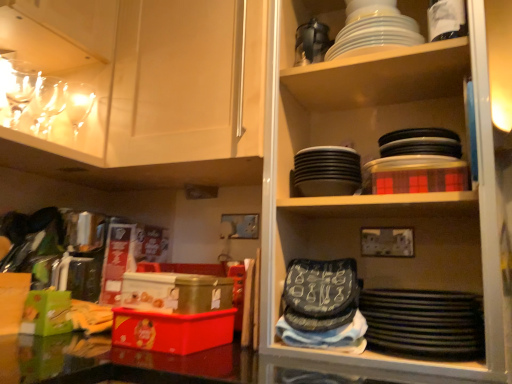
Question: From a real-world perspective, is clear glass wine glasses at upper left, which is the second tableware from left to right, below matte white cabinet at upper left?

Choices:
 (A) yes
 (B) no

Answer: (A)

Question: From the image's perspective, does clear glass wine glasses at upper left, which is the second tableware from left to right, appear lower than matte white cabinet at upper left?

Choices:
 (A) no
 (B) yes

Answer: (B)

Question: From a real-world perspective, is clear glass wine glasses at upper left, which is the second tableware from left to right, physically above matte white cabinet at upper left?

Choices:
 (A) no
 (B) yes

Answer: (A)

Question: Does clear glass wine glasses at upper left, acting as the third tableware starting from the right, have a greater height compared to matte white cabinet at upper left?

Choices:
 (A) no
 (B) yes

Answer: (A)

Question: From the image's perspective, is clear glass wine glasses at upper left, which is the second tableware from left to right, over matte white cabinet at upper left?

Choices:
 (A) yes
 (B) no

Answer: (B)

Question: In the image, is white glossy plates at upper center, positioned as the 4th tableware in left-to-right order, positioned in front of or behind black matte platter at lower right?

Choices:
 (A) behind
 (B) front

Answer: (A)

Question: From the image's perspective, relative to black matte platter at lower right, is white glossy plates at upper center, positioned as the 4th tableware in left-to-right order, above or below?

Choices:
 (A) below
 (B) above

Answer: (B)

Question: Do you think white glossy plates at upper center, the 1th tableware positioned from the right, is within black matte platter at lower right, or outside of it?

Choices:
 (A) outside
 (B) inside

Answer: (A)

Question: From a real-world perspective, relative to black matte platter at lower right, is white glossy plates at upper center, the 1th tableware positioned from the right, vertically above or below?

Choices:
 (A) below
 (B) above

Answer: (B)

Question: In the image, is clear glass wine glasses at upper left, which is the second tableware from left to right, on the left side or the right side of white glossy plates at upper center, positioned as the 4th tableware in left-to-right order?

Choices:
 (A) right
 (B) left

Answer: (B)

Question: In the image, is clear glass wine glasses at upper left, which is the second tableware from left to right, positioned in front of or behind white glossy plates at upper center, positioned as the 4th tableware in left-to-right order?

Choices:
 (A) front
 (B) behind

Answer: (B)

Question: Does point (41, 97) appear closer or farther from the camera than point (336, 44)?

Choices:
 (A) farther
 (B) closer

Answer: (A)

Question: Is clear glass wine glasses at upper left, which is the second tableware from left to right, inside or outside of white glossy plates at upper center, positioned as the 4th tableware in left-to-right order?

Choices:
 (A) inside
 (B) outside

Answer: (B)

Question: In terms of size, does clear glass wine glasses at upper left, marked as the fourth tableware in a right-to-left arrangement, appear bigger or smaller than matte white cabinet at upper left?

Choices:
 (A) big
 (B) small

Answer: (B)

Question: In terms of height, does clear glass wine glasses at upper left, which ranks as the first tableware in left-to-right order, look taller or shorter compared to matte white cabinet at upper left?

Choices:
 (A) short
 (B) tall

Answer: (A)